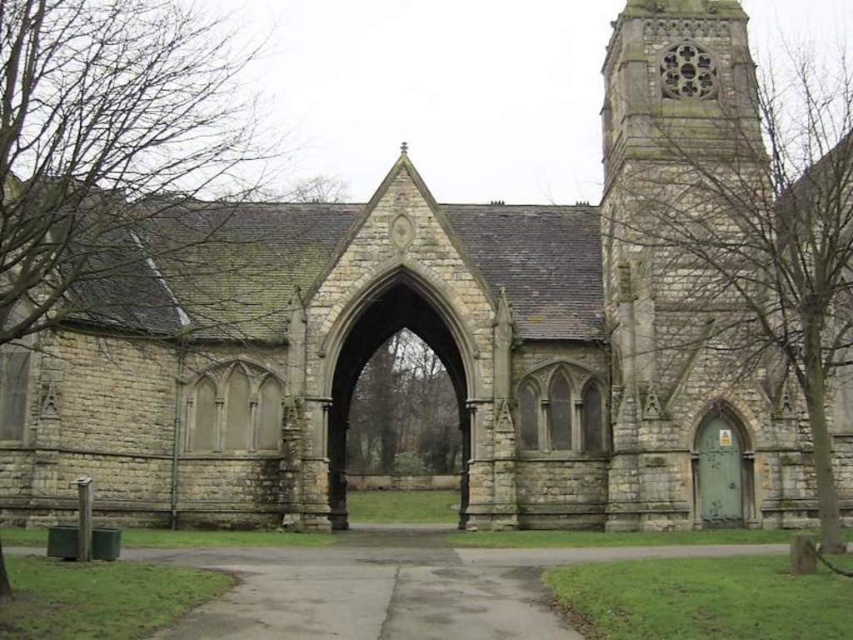
Is bare branches at left shorter than green leafy tree at center?

No, bare branches at left is not shorter than green leafy tree at center.

Between bare branches at left and green leafy tree at center, which one has less height?

With less height is green leafy tree at center.

The height and width of the screenshot is (640, 853). Describe the element at coordinates (119, 166) in the screenshot. I see `bare branches at left` at that location.

Identify the location of bare branches at left. (119, 166).

Does green stone tree at right have a larger size compared to bare branches at left?

Correct, green stone tree at right is larger in size than bare branches at left.

In order to click on green stone tree at right in this screenshot , I will do `click(730, 205)`.

At what (x,y) coordinates should I click in order to perform the action: click on green stone tree at right. Please return your answer as a coordinate pair (x, y). The width and height of the screenshot is (853, 640). Looking at the image, I should click on (730, 205).

In the scene shown: Is green stone tree at right shorter than green leafy tree at center?

Incorrect, green stone tree at right's height does not fall short of green leafy tree at center's.

Can you confirm if green stone tree at right is positioned to the right of green leafy tree at center?

Yes, green stone tree at right is to the right of green leafy tree at center.

Between point (715, 156) and point (393, 388), which one is positioned behind?

The point (393, 388) is behind.

Locate an element on the screen. This screenshot has width=853, height=640. green stone tree at right is located at coordinates (730, 205).